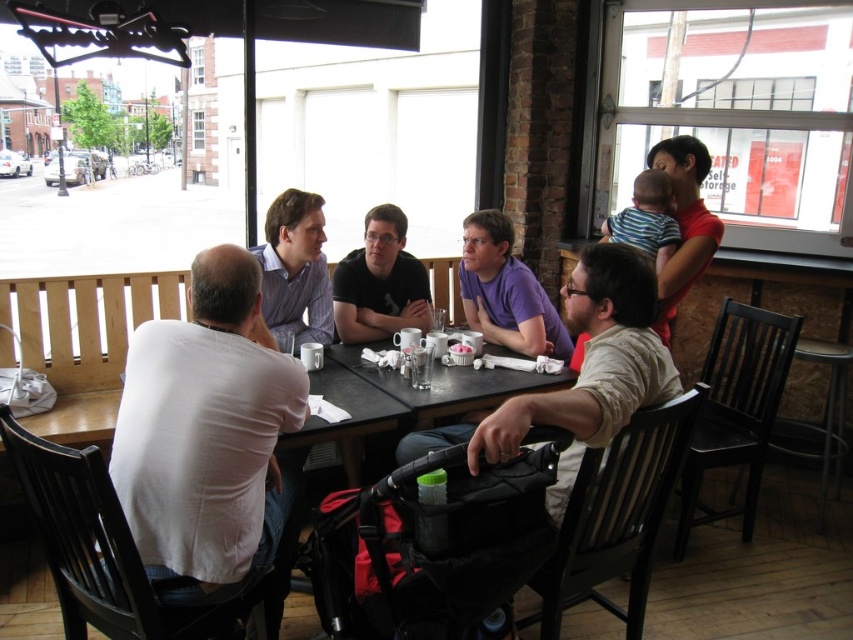
Consider the image. You are standing in a cafe and want to place a 1.5 meter long banner between you and the point at coordinates point (236, 506). Will the banner fit without bending?

The distance between you and the point (236, 506) is 1.71 meters. Since the banner is 1.5 meters long, it will fit with some space to spare.

You are sitting at the rectangular table in the image and want to place your phone on the table. There are two points marked on the table surface. The first point is at coordinates point (x=479, y=246) and the second is at point (x=273, y=301). If you want to place your phone behind the second point, which coordinate should you choose?

Point (x=479, y=246) is behind point (x=273, y=301), so you should place your phone at point (x=479, y=246) to have it behind the second point.

You are a photographer trying to capture a candid shot of the group at the rectangular table. You notice two men wearing purple cotton shirt at center and matte black shirt at center. Since you want to ensure both are clearly visible, which shirt should you focus on first based on their sizes?

The purple cotton shirt at center has a larger size compared to matte black shirt at center, so you should focus on the purple cotton shirt at center first to ensure it is clearly visible.